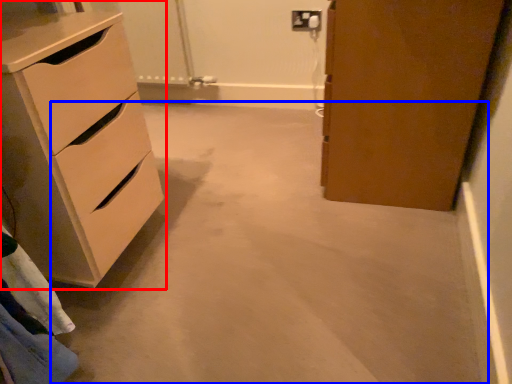
Question: Which of the following is the closest to the observer, chest of drawers (highlighted by a red box) or concrete (highlighted by a blue box)?

Choices:
 (A) chest of drawers
 (B) concrete

Answer: (B)